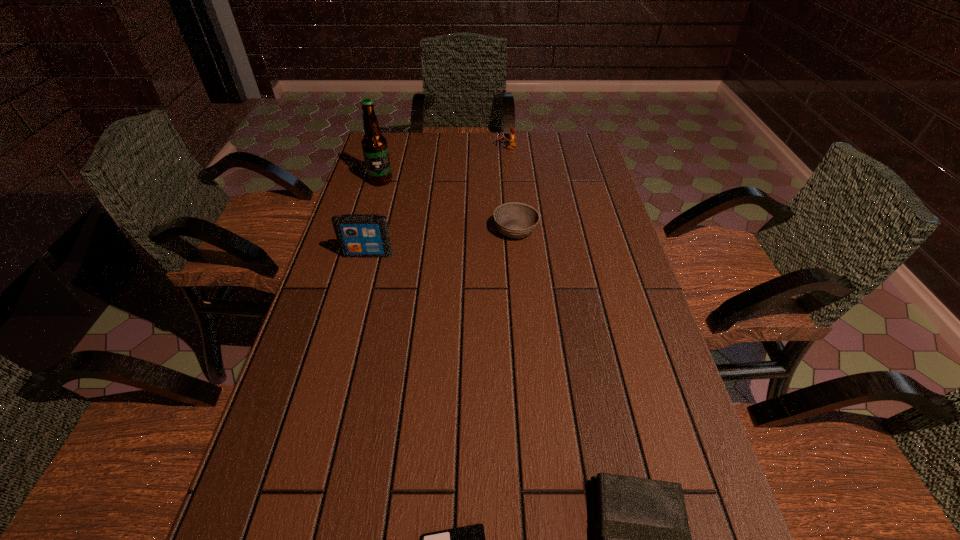
Where is `the fifth nearest object`? the fifth nearest object is located at coordinates 374,145.

Find the location of a particular element. This screenshot has height=540, width=960. beer bottle is located at coordinates (374, 145).

Find the location of a particular element. The image size is (960, 540). the left iPod is located at coordinates (359, 235).

Locate an element on the screen. the fourth farthest object is located at coordinates point(359,235).

Where is `the third tallest object`? Image resolution: width=960 pixels, height=540 pixels. the third tallest object is located at coordinates (511, 143).

Where is `the farthest object`? The image size is (960, 540). the farthest object is located at coordinates (511, 143).

What are the coordinates of `the fourth nearest object` in the screenshot? It's located at (515, 220).

Locate an element on the screen. vacant region located 0.120m on the label of the beer bottle is located at coordinates (372, 209).

You are a GUI agent. You are given a task and a screenshot of the screen. Output one action in this format:
    pyautogui.click(x=<x>, y=<y>)
    Task: Click on the vacant space located on the front screen of the left iPod
    This screenshot has height=540, width=960.
    Given the screenshot: What is the action you would take?
    pyautogui.click(x=363, y=271)

Identify the location of vacant space located holding a crossbow in the hands of the Lego. This screenshot has width=960, height=540. (405, 147).